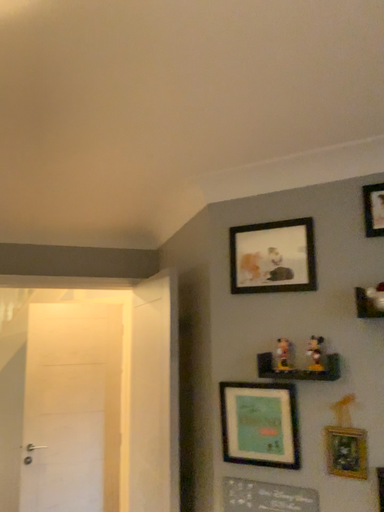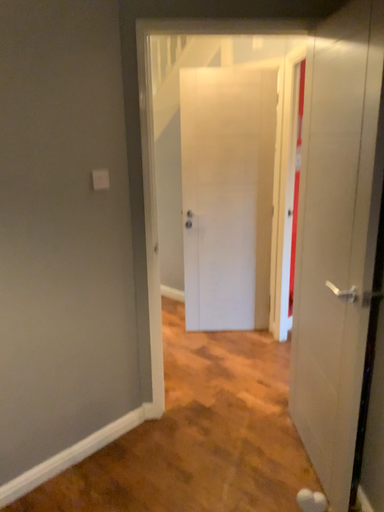
Question: How did the camera likely rotate when shooting the video?

Choices:
 (A) rotated upward
 (B) rotated downward

Answer: (B)